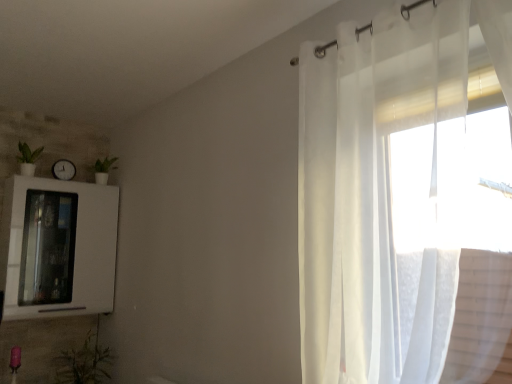
Describe the element at coordinates (382, 195) in the screenshot. I see `sheer white curtain at right` at that location.

Describe the element at coordinates (58, 248) in the screenshot. The image size is (512, 384). I see `white glossy medicine cabinet at left` at that location.

In order to face green leafy plant at lower left, which is the first plant from bottom to top, should I rotate leftwards or rightwards?

To face it directly, rotate left by 22.406 degrees.

The width and height of the screenshot is (512, 384). In order to click on sheer white curtain at right in this screenshot , I will do `click(382, 195)`.

Does sheer white curtain at right have a smaller size compared to white glossy medicine cabinet at left?

No.

Would you say sheer white curtain at right is a long distance from white glossy medicine cabinet at left?

Yes, sheer white curtain at right and white glossy medicine cabinet at left are quite far apart.

Is sheer white curtain at right in front of white glossy medicine cabinet at left?

Yes.

Which object is thinner, sheer white curtain at right or white glossy medicine cabinet at left?

sheer white curtain at right.

From the image's perspective, is green leafy plant at lower left, which ranks as the 2th plant in top-to-bottom order, positioned above or below sheer white curtain at right?

green leafy plant at lower left, which ranks as the 2th plant in top-to-bottom order, is situated lower than sheer white curtain at right in the image.

Can you confirm if green leafy plant at lower left, which is the first plant from bottom to top, is wider than sheer white curtain at right?

Indeed, green leafy plant at lower left, which is the first plant from bottom to top, has a greater width compared to sheer white curtain at right.

Image resolution: width=512 pixels, height=384 pixels. What are the coordinates of `the 1st plant to the left of the sheer white curtain at right, starting your count from the anchor` in the screenshot? It's located at (x=84, y=363).

How different are the orientations of green matte plant at left, which is counted as the 2th plant, starting from the right, and white glossy medicine cabinet at left in degrees?

The angular difference between green matte plant at left, which is counted as the 2th plant, starting from the right, and white glossy medicine cabinet at left is 0.000452 degrees.

From a real-world perspective, is green matte plant at left, which ranks as the 2th plant in bottom-to-top order, on white glossy medicine cabinet at left?

Yes, from a real-world perspective, green matte plant at left, which ranks as the 2th plant in bottom-to-top order, is above white glossy medicine cabinet at left.

Considering the positions of objects green matte plant at left, which is counted as the 2th plant, starting from the right, and white glossy medicine cabinet at left in the image provided, who is behind, green matte plant at left, which is counted as the 2th plant, starting from the right, or white glossy medicine cabinet at left?

green matte plant at left, which is counted as the 2th plant, starting from the right, is further away from the camera.

Does green matte plant at left, which ranks as the 2th plant in bottom-to-top order, appear on the left side of white glossy medicine cabinet at left?

Yes, green matte plant at left, which ranks as the 2th plant in bottom-to-top order, is to the left of white glossy medicine cabinet at left.

How much distance is there between green matte plant at left, the first plant in the top-to-bottom sequence, and white glossy clock at upper left?

They are 9.21 inches apart.

Considering the relative sizes of green matte plant at left, positioned as the 1th plant in left-to-right order, and white glossy clock at upper left in the image provided, is green matte plant at left, positioned as the 1th plant in left-to-right order, smaller than white glossy clock at upper left?

Actually, green matte plant at left, positioned as the 1th plant in left-to-right order, might be larger than white glossy clock at upper left.

Is green matte plant at left, the first plant in the top-to-bottom sequence, positioned with its back to white glossy clock at upper left?

No.

Is green matte plant at left, which ranks as the 2th plant in bottom-to-top order, bigger or smaller than green leafy plant at lower left, which ranks as the 2th plant in top-to-bottom order?

green matte plant at left, which ranks as the 2th plant in bottom-to-top order, is smaller than green leafy plant at lower left, which ranks as the 2th plant in top-to-bottom order.

From the image's perspective, is green matte plant at left, the first plant in the top-to-bottom sequence, positioned above or below green leafy plant at lower left, which is the first plant from bottom to top?

From the image's perspective, green matte plant at left, the first plant in the top-to-bottom sequence, appears above green leafy plant at lower left, which is the first plant from bottom to top.

Which object is closer to the camera taking this photo, green matte plant at left, which ranks as the 2th plant in bottom-to-top order, or green leafy plant at lower left, the first plant when ordered from right to left?

Result: Positioned in front is green leafy plant at lower left, the first plant when ordered from right to left.

Which object is thinner, green matte plant at left, which is counted as the 2th plant, starting from the right, or green leafy plant at lower left, the first plant when ordered from right to left?

Thinner between the two is green matte plant at left, which is counted as the 2th plant, starting from the right.

From the image's perspective, between white glossy medicine cabinet at left and green leafy plant at lower left, which is the first plant from bottom to top, who is located below?

green leafy plant at lower left, which is the first plant from bottom to top, appears lower in the image.

Does white glossy medicine cabinet at left have a smaller size compared to green leafy plant at lower left, which is the first plant from bottom to top?

No, white glossy medicine cabinet at left is not smaller than green leafy plant at lower left, which is the first plant from bottom to top.

Considering the sizes of objects white glossy medicine cabinet at left and green leafy plant at lower left, which ranks as the 2th plant in top-to-bottom order, in the image provided, who is shorter, white glossy medicine cabinet at left or green leafy plant at lower left, which ranks as the 2th plant in top-to-bottom order,?

green leafy plant at lower left, which ranks as the 2th plant in top-to-bottom order.

Which of these two, green leafy plant at lower left, which ranks as the 2th plant in top-to-bottom order, or white glossy medicine cabinet at left, is smaller?

With smaller size is green leafy plant at lower left, which ranks as the 2th plant in top-to-bottom order.

In the scene shown: From a real-world perspective, between green leafy plant at lower left, arranged as the second plant when viewed from the left, and white glossy medicine cabinet at left, who is vertically lower?

green leafy plant at lower left, arranged as the second plant when viewed from the left.

Is green leafy plant at lower left, which is the first plant from bottom to top, positioned with its back to white glossy medicine cabinet at left?

green leafy plant at lower left, which is the first plant from bottom to top, is not turned away from white glossy medicine cabinet at left.

Identify the location of curtain above the white glossy medicine cabinet at left (from a real-world perspective). click(382, 195).

Locate an element on the screen. plant located below the sheer white curtain at right (from the image's perspective) is located at coordinates (84, 363).

Considering their positions, is green leafy plant at lower left, arranged as the second plant when viewed from the left, positioned further to white glossy medicine cabinet at left than green matte plant at left, the first plant in the top-to-bottom sequence?

green matte plant at left, the first plant in the top-to-bottom sequence, is positioned further to the anchor white glossy medicine cabinet at left.

Considering their positions, is white glossy clock at upper left positioned closer to sheer white curtain at right than green leafy plant at lower left, the first plant when ordered from right to left?

green leafy plant at lower left, the first plant when ordered from right to left, is positioned closer to the anchor sheer white curtain at right.

From the image, which object appears to be nearer to white glossy clock at upper left, green matte plant at left, which ranks as the 2th plant in bottom-to-top order, or white glossy medicine cabinet at left?

green matte plant at left, which ranks as the 2th plant in bottom-to-top order, is positioned closer to the anchor white glossy clock at upper left.

Looking at the image, which one is located further to green matte plant at left, positioned as the 1th plant in left-to-right order, sheer white curtain at right or green leafy plant at lower left, the first plant when ordered from right to left?

sheer white curtain at right is further to green matte plant at left, positioned as the 1th plant in left-to-right order.

Estimate the real-world distances between objects in this image. Which object is closer to white glossy medicine cabinet at left, green leafy plant at lower left, which is the first plant from bottom to top, or sheer white curtain at right?

green leafy plant at lower left, which is the first plant from bottom to top, is positioned closer to the anchor white glossy medicine cabinet at left.

From the image, which object appears to be farther from sheer white curtain at right, green matte plant at left, which is counted as the 2th plant, starting from the right, or green leafy plant at lower left, arranged as the second plant when viewed from the left?

green matte plant at left, which is counted as the 2th plant, starting from the right.

Considering their positions, is green matte plant at left, which ranks as the 2th plant in bottom-to-top order, positioned closer to white glossy medicine cabinet at left than white glossy clock at upper left?

white glossy clock at upper left lies closer to white glossy medicine cabinet at left than the other object.

Estimate the real-world distances between objects in this image. Which object is closer to white glossy medicine cabinet at left, sheer white curtain at right or green matte plant at left, the first plant in the top-to-bottom sequence?

green matte plant at left, the first plant in the top-to-bottom sequence, is closer to white glossy medicine cabinet at left.

The image size is (512, 384). I want to click on medicine cabinet between white glossy clock at upper left and green leafy plant at lower left, the first plant when ordered from right to left, vertically, so click(x=58, y=248).

Image resolution: width=512 pixels, height=384 pixels. What are the coordinates of `medicine cabinet between green matte plant at left, which ranks as the 2th plant in bottom-to-top order, and sheer white curtain at right from left to right` in the screenshot? It's located at (58, 248).

Locate an element on the screen. medicine cabinet between green matte plant at left, which ranks as the 2th plant in bottom-to-top order, and green leafy plant at lower left, which is the first plant from bottom to top, from top to bottom is located at coordinates (58, 248).

Identify the location of clock between green matte plant at left, which is counted as the 2th plant, starting from the right, and white glossy medicine cabinet at left, in the vertical direction. (63, 170).